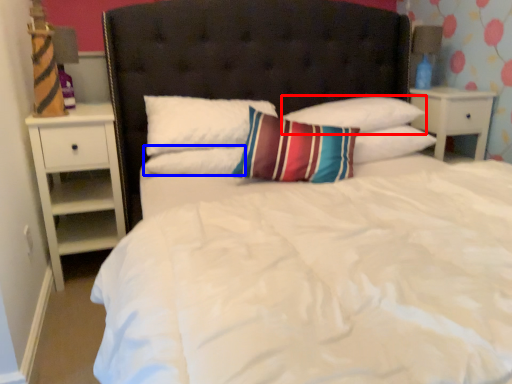
Question: Which object appears farthest to the camera in this image, pillow (highlighted by a red box) or pillow (highlighted by a blue box)?

Choices:
 (A) pillow
 (B) pillow

Answer: (A)